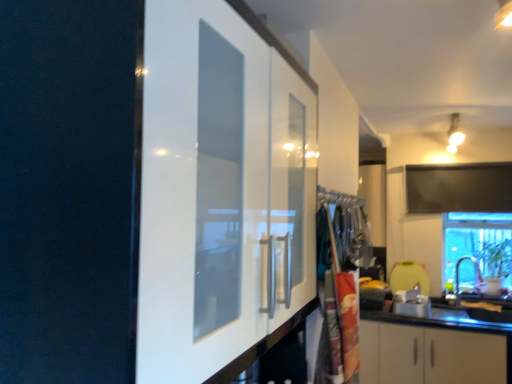
Question: From a real-world perspective, is transparent glass window at lower right physically located above or below matte silver sink at lower right?

Choices:
 (A) below
 (B) above

Answer: (B)

Question: Is transparent glass window at lower right in front of or behind matte silver sink at lower right in the image?

Choices:
 (A) front
 (B) behind

Answer: (B)

Question: Which object is the closest to the matte silver sink at lower right?

Choices:
 (A) transparent glass window at lower right
 (B) polyester laundry bag at center

Answer: (A)

Question: Based on their relative distances, which object is nearer to the matte silver sink at lower right?

Choices:
 (A) transparent glass window at lower right
 (B) polyester laundry bag at center

Answer: (A)